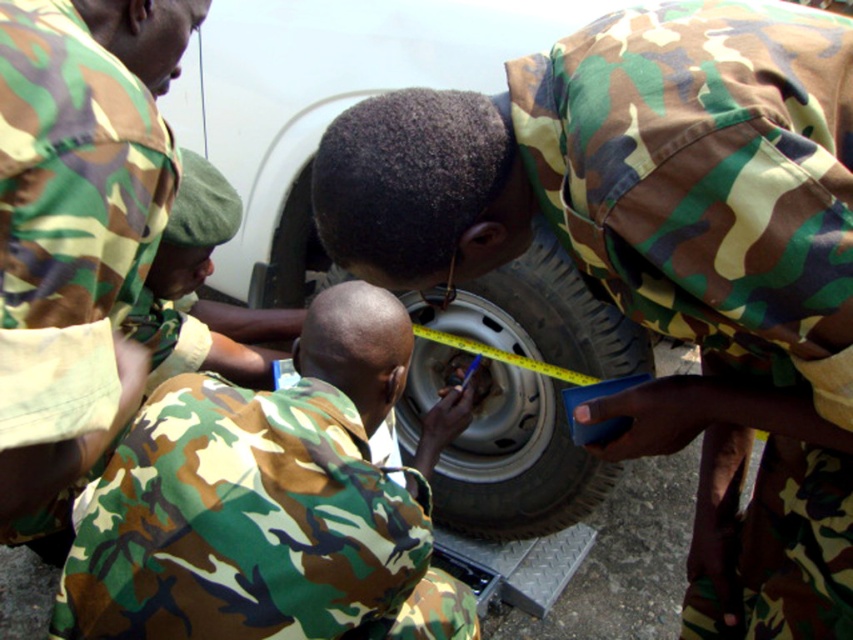
You are a photographer trying to capture a photo of the camouflage fabric uniform at center and the silver metallic wheel at center. If you want to ensure both are fully visible in the frame, which object should you position closer to the camera to avoid cropping?

The camouflage fabric uniform at center might be wider than silver metallic wheel at center, so you should position the camouflage fabric uniform at center closer to the camera to ensure it fits within the frame.

Based on the scene description, where is the camouflage fabric uniform at left positioned in relation to the other objects?

The camouflage fabric uniform at left is located at point (77, 225) according to the coordinates provided.

You are a military inspector needing to check the distance between the camouflage fabric uniform at center and the silver metallic wheel at center. According to regulations, the minimum safe distance required is 30 inches. Is the current distance compliant with safety standards?

The distance between the camouflage fabric uniform at center and the silver metallic wheel at center is 28.80 inches, which is less than the required 30 inches. Therefore, it does not comply with safety standards.